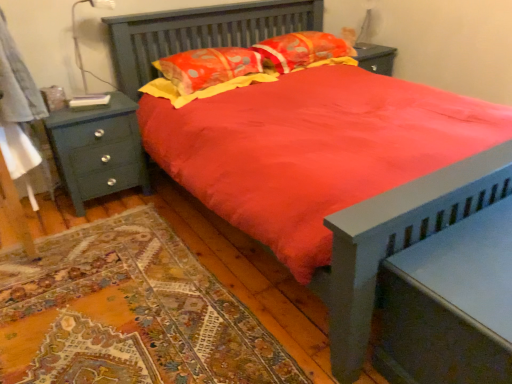
This screenshot has width=512, height=384. Describe the element at coordinates (98, 150) in the screenshot. I see `teal wood nightstand at left, which appears as the first nightstand when viewed from the top` at that location.

What do you see at coordinates (208, 67) in the screenshot? The height and width of the screenshot is (384, 512). I see `quilted orange pillow at center, which ranks as the 2th pillow in right-to-left order` at bounding box center [208, 67].

You are a GUI agent. You are given a task and a screenshot of the screen. Output one action in this format:
    pyautogui.click(x=<x>, y=<y>)
    Task: Click on the floral fabric pillow at upper center, which is the second pillow from left to right
    The image size is (512, 384).
    Given the screenshot: What is the action you would take?
    click(301, 50)

This screenshot has width=512, height=384. What do you see at coordinates (78, 42) in the screenshot? I see `metallic gray table lamp at upper left` at bounding box center [78, 42].

This screenshot has height=384, width=512. In order to click on teal wood nightstand at left, marked as the 1th nightstand in a back-to-front arrangement in this screenshot , I will do `click(98, 150)`.

Could you tell me if quilted orange pillow at center, positioned as the first pillow in left-to-right order, is turned towards teal wood nightstand at left, which ranks as the 2th nightstand in front-to-back order?

No, quilted orange pillow at center, positioned as the first pillow in left-to-right order, is not oriented towards teal wood nightstand at left, which ranks as the 2th nightstand in front-to-back order.

Is quilted orange pillow at center, positioned as the first pillow in left-to-right order, completely or partially outside of teal wood nightstand at left, the 2th nightstand in the bottom-to-top sequence?

Yes, quilted orange pillow at center, positioned as the first pillow in left-to-right order, is not within teal wood nightstand at left, the 2th nightstand in the bottom-to-top sequence.

Which is more to the left, quilted orange pillow at center, which ranks as the 2th pillow in right-to-left order, or teal wood nightstand at left, the 2th nightstand in the bottom-to-top sequence?

From the viewer's perspective, teal wood nightstand at left, the 2th nightstand in the bottom-to-top sequence, appears more on the left side.

Which of these two, metallic gray table lamp at upper left or quilted orange pillow at center, positioned as the first pillow in left-to-right order, is smaller?

metallic gray table lamp at upper left is smaller.

Is metallic gray table lamp at upper left with quilted orange pillow at center, positioned as the first pillow in left-to-right order?

No, metallic gray table lamp at upper left is not with quilted orange pillow at center, positioned as the first pillow in left-to-right order.

Which is farther from the camera, (73, 9) or (237, 64)?

Positioned behind is point (237, 64).

I want to click on table lamp on the left of quilted orange pillow at center, which ranks as the 2th pillow in right-to-left order, so click(78, 42).

Which is in front, metallic gray table lamp at upper left or teal wood nightstand at left, marked as the 1th nightstand in a back-to-front arrangement?

teal wood nightstand at left, marked as the 1th nightstand in a back-to-front arrangement, is in front.

From a real-world perspective, is metallic gray table lamp at upper left positioned above or below teal wood nightstand at left, the 2th nightstand in the bottom-to-top sequence?

From a real-world perspective, metallic gray table lamp at upper left is physically above teal wood nightstand at left, the 2th nightstand in the bottom-to-top sequence.

Which is more to the left, metallic gray table lamp at upper left or teal wood nightstand at left, marked as the 1th nightstand in a back-to-front arrangement?

teal wood nightstand at left, marked as the 1th nightstand in a back-to-front arrangement.

At what (x,y) coordinates should I click in order to perform the action: click on table lamp on the right of teal wood nightstand at left, which ranks as the 2th nightstand in front-to-back order. Please return your answer as a coordinate pair (x, y). This screenshot has width=512, height=384. Looking at the image, I should click on (78, 42).

Consider the image. Is teal wood nightstand at left, the 2th nightstand in the bottom-to-top sequence, positioned before floral fabric pillow at upper center, which is the 1th pillow in right-to-left order?

Yes, teal wood nightstand at left, the 2th nightstand in the bottom-to-top sequence, is in front of floral fabric pillow at upper center, which is the 1th pillow in right-to-left order.

From the image's perspective, is teal wood nightstand at left, which ranks as the 2th nightstand in front-to-back order, beneath floral fabric pillow at upper center, which is the second pillow from left to right?

Indeed, from the image's perspective, teal wood nightstand at left, which ranks as the 2th nightstand in front-to-back order, is shown beneath floral fabric pillow at upper center, which is the second pillow from left to right.

Is teal wood nightstand at left, which appears as the first nightstand when viewed from the top, not within floral fabric pillow at upper center, which is the 1th pillow in right-to-left order?

That's correct, teal wood nightstand at left, which appears as the first nightstand when viewed from the top, is outside of floral fabric pillow at upper center, which is the 1th pillow in right-to-left order.

Could you tell me if teal wood nightstand at left, arranged as the 2th nightstand when viewed from the right, is turned towards floral fabric pillow at upper center, which is the second pillow from left to right?

No, teal wood nightstand at left, arranged as the 2th nightstand when viewed from the right, does not turn towards floral fabric pillow at upper center, which is the second pillow from left to right.

Which nightstand is the 2nd one when counting from the front of the floral fabric pillow at upper center, which is the 1th pillow in right-to-left order? Please provide its 2D coordinates.

[(450, 305)]

Does floral fabric pillow at upper center, which is the 1th pillow in right-to-left order, have a lesser width compared to matte gray nightstand at lower right, which ranks as the second nightstand in left-to-right order?

Correct, the width of floral fabric pillow at upper center, which is the 1th pillow in right-to-left order, is less than that of matte gray nightstand at lower right, which ranks as the second nightstand in left-to-right order.

Considering the relative sizes of floral fabric pillow at upper center, which is the 1th pillow in right-to-left order, and matte gray nightstand at lower right, marked as the first nightstand in a front-to-back arrangement, in the image provided, is floral fabric pillow at upper center, which is the 1th pillow in right-to-left order, taller than matte gray nightstand at lower right, marked as the first nightstand in a front-to-back arrangement,?

Incorrect, the height of floral fabric pillow at upper center, which is the 1th pillow in right-to-left order, is not larger of that of matte gray nightstand at lower right, marked as the first nightstand in a front-to-back arrangement.

Are floral fabric pillow at upper center, which is the 1th pillow in right-to-left order, and matte gray nightstand at lower right, which ranks as the second nightstand in left-to-right order, making contact?

floral fabric pillow at upper center, which is the 1th pillow in right-to-left order, is not next to matte gray nightstand at lower right, which ranks as the second nightstand in left-to-right order, and they're not touching.

Is point (267, 60) behind point (231, 50)?

Yes.

Is floral fabric pillow at upper center, which is the 1th pillow in right-to-left order, further to camera compared to quilted orange pillow at center, positioned as the first pillow in left-to-right order?

Yes, floral fabric pillow at upper center, which is the 1th pillow in right-to-left order, is further from the camera.

You are a GUI agent. You are given a task and a screenshot of the screen. Output one action in this format:
    pyautogui.click(x=<x>, y=<y>)
    Task: Click on the pillow lying on the right of quilted orange pillow at center, which ranks as the 2th pillow in right-to-left order
    The image size is (512, 384).
    Given the screenshot: What is the action you would take?
    pyautogui.click(x=301, y=50)

Is floral fabric pillow at upper center, which is the second pillow from left to right, positioned beyond the bounds of quilted orange pillow at center, positioned as the first pillow in left-to-right order?

Yes, floral fabric pillow at upper center, which is the second pillow from left to right, is not within quilted orange pillow at center, positioned as the first pillow in left-to-right order.

Consider the image. Considering the sizes of matte gray nightstand at lower right, which is counted as the second nightstand, starting from the top, and quilted orange pillow at center, which ranks as the 2th pillow in right-to-left order, in the image, is matte gray nightstand at lower right, which is counted as the second nightstand, starting from the top, wider or thinner than quilted orange pillow at center, which ranks as the 2th pillow in right-to-left order,?

matte gray nightstand at lower right, which is counted as the second nightstand, starting from the top, is thinner than quilted orange pillow at center, which ranks as the 2th pillow in right-to-left order.

How far apart are matte gray nightstand at lower right, which ranks as the second nightstand in left-to-right order, and quilted orange pillow at center, which ranks as the 2th pillow in right-to-left order?

matte gray nightstand at lower right, which ranks as the second nightstand in left-to-right order, and quilted orange pillow at center, which ranks as the 2th pillow in right-to-left order, are 1.80 meters apart.

From a real-world perspective, which is physically above, matte gray nightstand at lower right, marked as the first nightstand in a front-to-back arrangement, or quilted orange pillow at center, positioned as the first pillow in left-to-right order?

quilted orange pillow at center, positioned as the first pillow in left-to-right order.

Is matte gray nightstand at lower right, which is counted as the second nightstand, starting from the top, directly adjacent to quilted orange pillow at center, which ranks as the 2th pillow in right-to-left order?

No, matte gray nightstand at lower right, which is counted as the second nightstand, starting from the top, is not beside quilted orange pillow at center, which ranks as the 2th pillow in right-to-left order.

Where is `nightstand on the left of quilted orange pillow at center, which ranks as the 2th pillow in right-to-left order`? nightstand on the left of quilted orange pillow at center, which ranks as the 2th pillow in right-to-left order is located at coordinates pos(98,150).

I want to click on the 1st pillow behind when counting from the metallic gray table lamp at upper left, so click(208, 67).

Based on their spatial positions, is metallic gray table lamp at upper left or teal wood nightstand at left, positioned as the first nightstand in left-to-right order, further from floral fabric pillow at upper center, which is the 1th pillow in right-to-left order?

metallic gray table lamp at upper left is further to floral fabric pillow at upper center, which is the 1th pillow in right-to-left order.

Looking at the image, which one is located further to floral fabric pillow at upper center, which is the second pillow from left to right, quilted orange pillow at center, positioned as the first pillow in left-to-right order, or metallic gray table lamp at upper left?

Based on the image, metallic gray table lamp at upper left appears to be further to floral fabric pillow at upper center, which is the second pillow from left to right.

Looking at this image, when comparing their distances from matte gray nightstand at lower right, marked as the first nightstand in a front-to-back arrangement, does floral fabric pillow at upper center, which is the second pillow from left to right, or metallic gray table lamp at upper left seem closer?

floral fabric pillow at upper center, which is the second pillow from left to right, is positioned closer to the anchor matte gray nightstand at lower right, marked as the first nightstand in a front-to-back arrangement.

Based on their spatial positions, is quilted orange pillow at center, positioned as the first pillow in left-to-right order, or floral fabric pillow at upper center, which is the second pillow from left to right, closer to teal wood nightstand at left, the 2th nightstand in the bottom-to-top sequence?

The object closer to teal wood nightstand at left, the 2th nightstand in the bottom-to-top sequence, is quilted orange pillow at center, positioned as the first pillow in left-to-right order.

When comparing their distances from teal wood nightstand at left, arranged as the 2th nightstand when viewed from the right, does metallic gray table lamp at upper left or matte gray nightstand at lower right, placed as the 1th nightstand when sorted from bottom to top, seem further?

matte gray nightstand at lower right, placed as the 1th nightstand when sorted from bottom to top, lies further to teal wood nightstand at left, arranged as the 2th nightstand when viewed from the right, than the other object.

Based on their spatial positions, is matte gray nightstand at lower right, marked as the first nightstand in a front-to-back arrangement, or quilted orange pillow at center, which ranks as the 2th pillow in right-to-left order, closer to teal wood nightstand at left, arranged as the 2th nightstand when viewed from the right?

Among the two, quilted orange pillow at center, which ranks as the 2th pillow in right-to-left order, is located nearer to teal wood nightstand at left, arranged as the 2th nightstand when viewed from the right.

Based on the photo, from the image, which object appears to be nearer to teal wood nightstand at left, arranged as the 2th nightstand when viewed from the right, quilted orange pillow at center, positioned as the first pillow in left-to-right order, or matte gray nightstand at lower right, marked as the first nightstand in a front-to-back arrangement?

quilted orange pillow at center, positioned as the first pillow in left-to-right order, is positioned closer to the anchor teal wood nightstand at left, arranged as the 2th nightstand when viewed from the right.

Based on their spatial positions, is quilted orange pillow at center, positioned as the first pillow in left-to-right order, or floral fabric pillow at upper center, which is the second pillow from left to right, further from matte gray nightstand at lower right, placed as the 1th nightstand when sorted from bottom to top?

floral fabric pillow at upper center, which is the second pillow from left to right, is further to matte gray nightstand at lower right, placed as the 1th nightstand when sorted from bottom to top.

Where is `table lamp situated between teal wood nightstand at left, which appears as the first nightstand when viewed from the top, and quilted orange pillow at center, positioned as the first pillow in left-to-right order, from left to right`? table lamp situated between teal wood nightstand at left, which appears as the first nightstand when viewed from the top, and quilted orange pillow at center, positioned as the first pillow in left-to-right order, from left to right is located at coordinates (78, 42).

Where is `pillow between matte gray nightstand at lower right, which appears as the 1th nightstand when viewed from the right, and floral fabric pillow at upper center, which is the second pillow from left to right, from front to back`? The width and height of the screenshot is (512, 384). pillow between matte gray nightstand at lower right, which appears as the 1th nightstand when viewed from the right, and floral fabric pillow at upper center, which is the second pillow from left to right, from front to back is located at coordinates (208, 67).

Identify the location of pillow between teal wood nightstand at left, positioned as the first nightstand in left-to-right order, and floral fabric pillow at upper center, which is the second pillow from left to right. The width and height of the screenshot is (512, 384). (208, 67).

At what (x,y) coordinates should I click in order to perform the action: click on table lamp between teal wood nightstand at left, marked as the 1th nightstand in a back-to-front arrangement, and matte gray nightstand at lower right, which appears as the 1th nightstand when viewed from the right, in the horizontal direction. Please return your answer as a coordinate pair (x, y). This screenshot has width=512, height=384. Looking at the image, I should click on (78, 42).